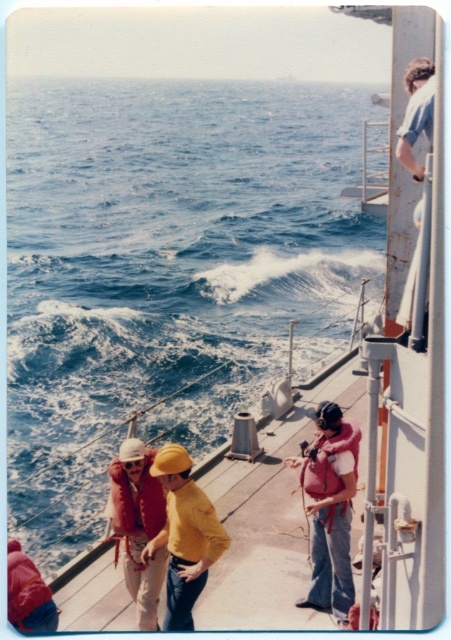
You are a crew member on the ship and need to retrieve a life jacket. You see both the matte red life jacket at center and the matte pink life jacket at center. Which one is closer to you?

The matte red life jacket at center is closer because it is in front of the matte pink life jacket at center.